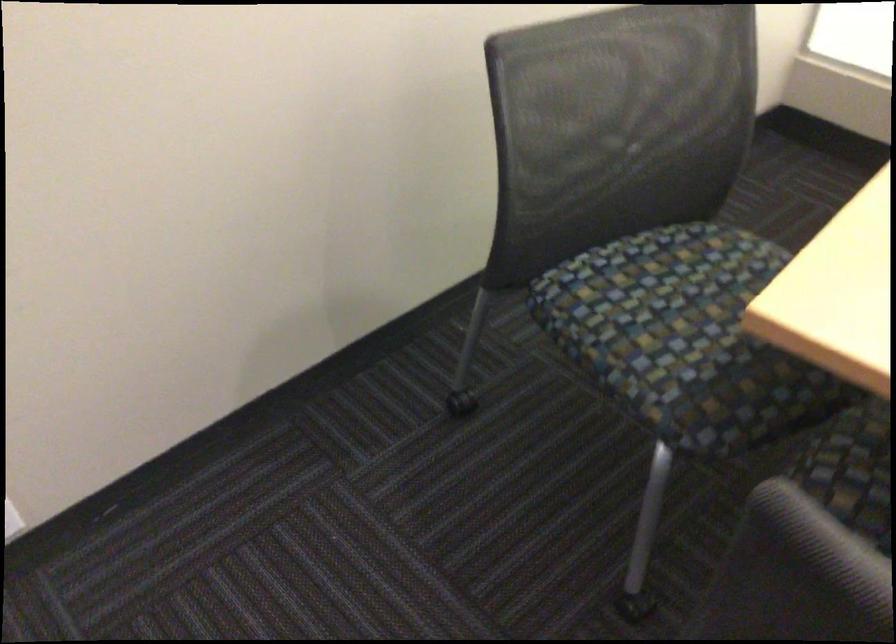
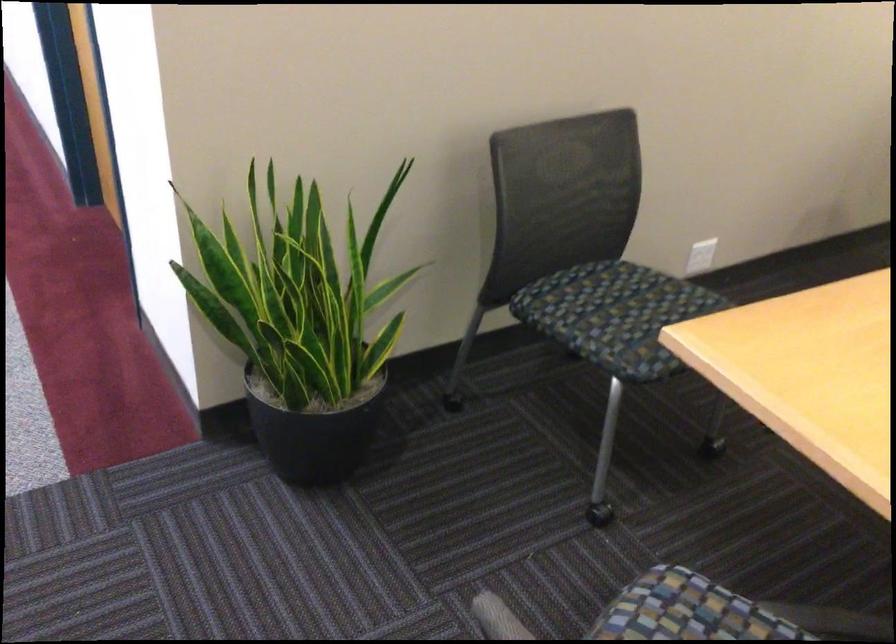
In a continuous first-person perspective shot, in which direction is the camera moving?

The movement direction of the cameraman is left, backward.